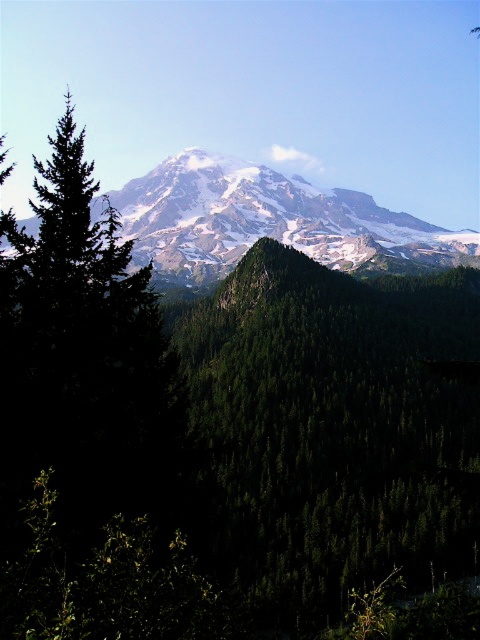
You are a hiker standing at the base of the mountain and see the point marked at coordinates (x=332, y=429). What object is located at that point?

The point at coordinates (x=332, y=429) indicates a green matte tree at center.

You are an environmental scientist studying the mountain ecosystem. You observe the green matte tree at center and the snowy granite mountain range at upper center. Which object is located to the right of the other?

The green matte tree at center is positioned on the right side of the snowy granite mountain range at upper center.